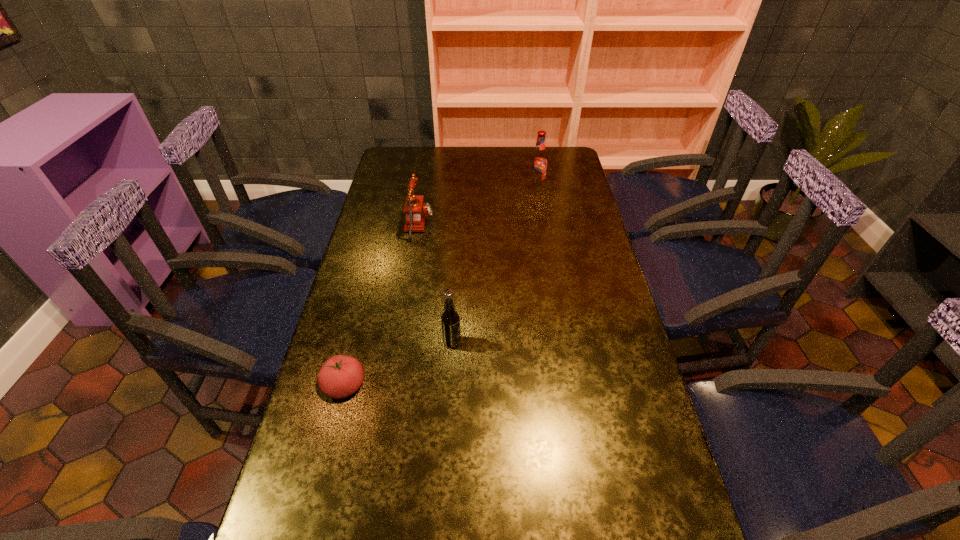
Identify the location of vacant space that's between the shorter root beer and the taller root beer. Image resolution: width=960 pixels, height=540 pixels. (494, 265).

This screenshot has height=540, width=960. I want to click on free space between the third shortest object and the shortest object, so pos(398,364).

Locate an element on the screen. This screenshot has width=960, height=540. empty space between the shorter root beer and the taller root beer is located at coordinates (494, 265).

This screenshot has height=540, width=960. What are the coordinates of `empty space between the tallest object and the third tallest object` in the screenshot? It's located at (478, 206).

At what (x,y) coordinates should I click in order to perform the action: click on free space that is in between the right root beer and the nearest object. Please return your answer as a coordinate pair (x, y). This screenshot has height=540, width=960. Looking at the image, I should click on (441, 287).

Locate an element on the screen. The height and width of the screenshot is (540, 960). free space between the shorter root beer and the tallest object is located at coordinates (494, 265).

I want to click on free spot between the second object from right to left and the tomato, so click(x=398, y=364).

The height and width of the screenshot is (540, 960). Find the location of `free space between the shortest object and the left root beer`. free space between the shortest object and the left root beer is located at coordinates (398, 364).

Point out which object is positioned as the nearest to the shortest object. Please provide its 2D coordinates. Your answer should be formatted as a tuple, i.e. [(x, y)], where the tuple contains the x and y coordinates of a point satisfying the conditions above.

[(450, 320)]

Image resolution: width=960 pixels, height=540 pixels. I want to click on the closest object to the left root beer, so click(x=341, y=376).